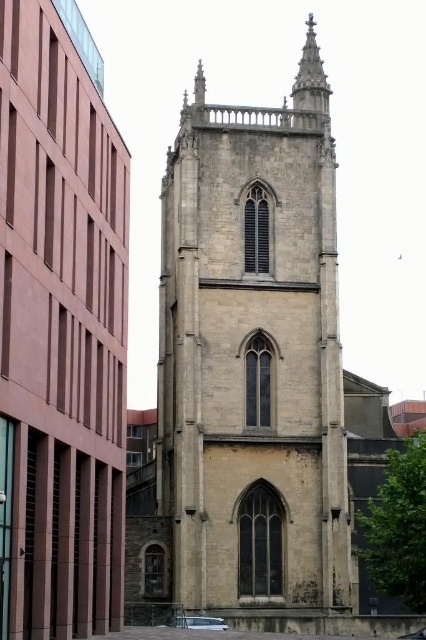
You are an architect analyzing the spatial relationship between the beige stone church at center and the stone spire at upper center. Which structure is positioned higher in the image?

The stone spire at upper center is positioned higher than the beige stone church at center in the image.

You are standing at the center of the image and want to walk towards the beige stone tower at center. In which direction should you move?

The beige stone tower at center is already at the center of the image, so you are already facing it directly. No need to move in any direction.

You are an architect planning to install a new lighting system between the beige stone tower at center and the stone spire at upper center. The lighting system requires a minimum distance of 15 meters between the fixtures. Can the system be installed as planned?

The beige stone tower at center is 16.59 meters from the stone spire at upper center. Since the required minimum distance is 15 meters, the lighting system can be installed as planned between the beige stone tower at center and the stone spire at upper center.